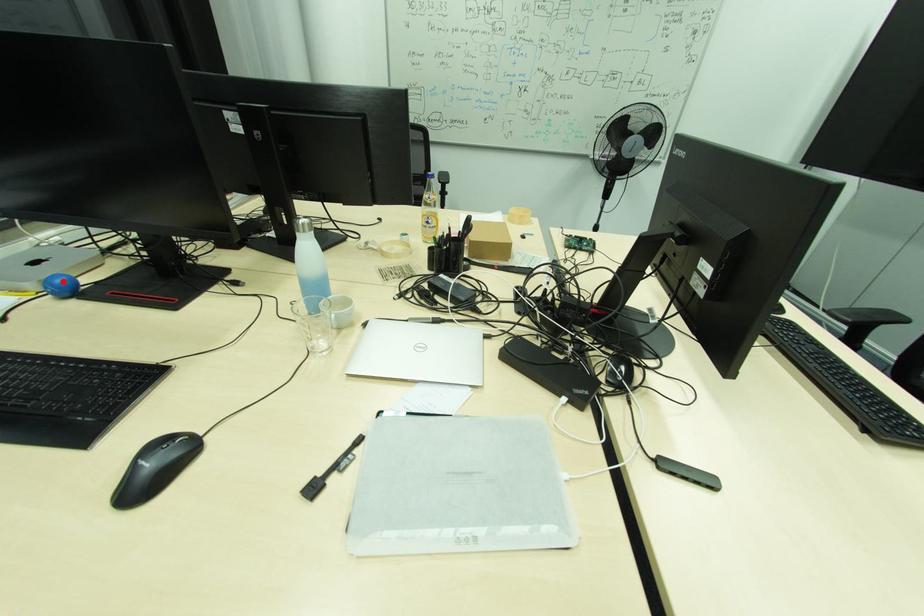
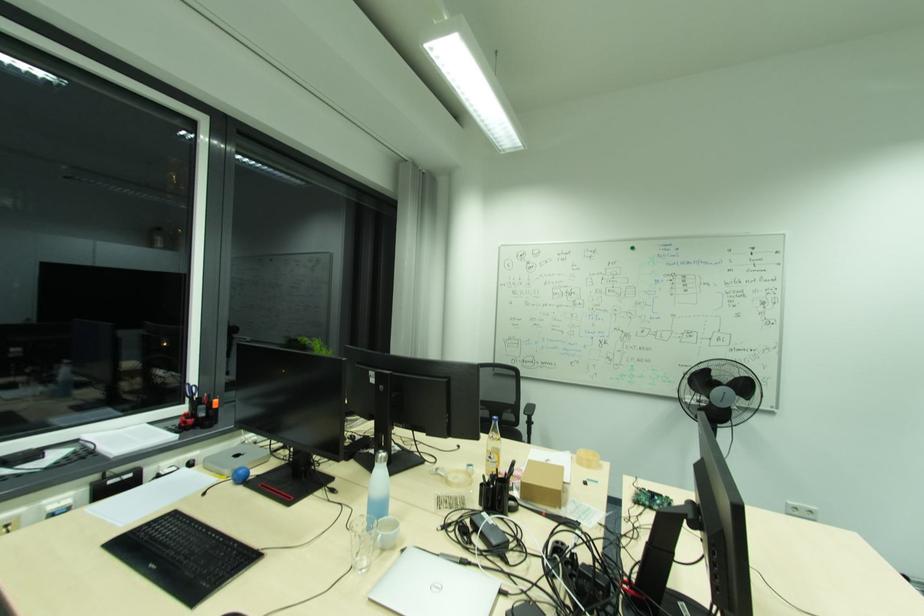
The point at the highlighted location is marked in the first image. Where is the corresponding point in the second image?

(246, 472)